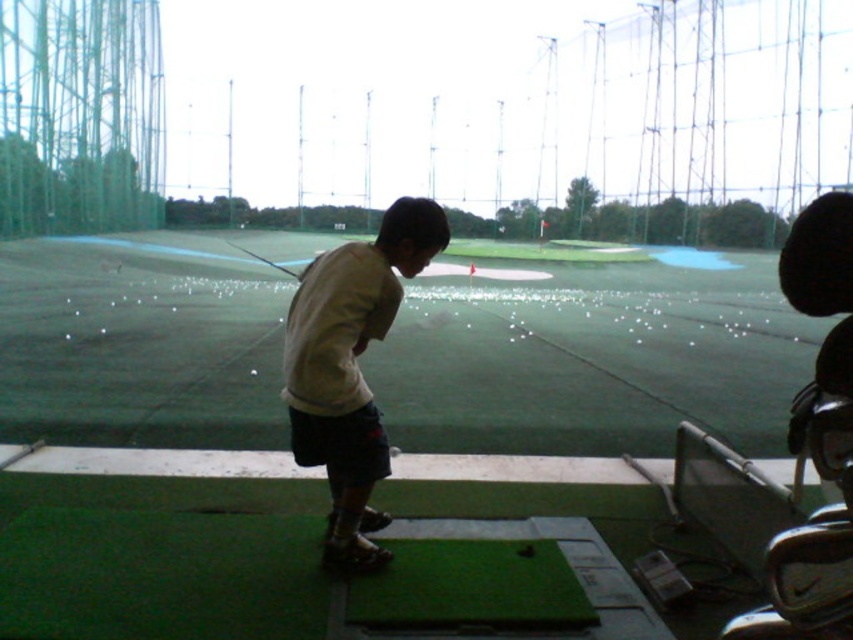
Does green artificial turf at center appear under light beige shirt at center?

Incorrect, green artificial turf at center is not positioned below light beige shirt at center.

Where is `green artificial turf at center`? The width and height of the screenshot is (853, 640). green artificial turf at center is located at coordinates (595, 358).

How distant is light beige shirt at center from metallic silver golf club at center?

A distance of 12.33 meters exists between light beige shirt at center and metallic silver golf club at center.

Does light beige shirt at center have a lesser width compared to metallic silver golf club at center?

Indeed, light beige shirt at center has a lesser width compared to metallic silver golf club at center.

Find the location of `light beige shirt at center`. light beige shirt at center is located at coordinates (351, 368).

You are a GUI agent. You are given a task and a screenshot of the screen. Output one action in this format:
    pyautogui.click(x=<x>, y=<y>)
    Task: Click on the light beige shirt at center
    The width and height of the screenshot is (853, 640).
    Given the screenshot: What is the action you would take?
    pyautogui.click(x=351, y=368)

Who is higher up, green artificial turf at center or metallic silver golf club at center?

metallic silver golf club at center is higher up.

Can you confirm if green artificial turf at center is wider than metallic silver golf club at center?

Correct, the width of green artificial turf at center exceeds that of metallic silver golf club at center.

Is point (715, 353) farther from camera compared to point (289, 275)?

No, it is in front of (289, 275).

Where is `green artificial turf at center`? The width and height of the screenshot is (853, 640). green artificial turf at center is located at coordinates (595, 358).